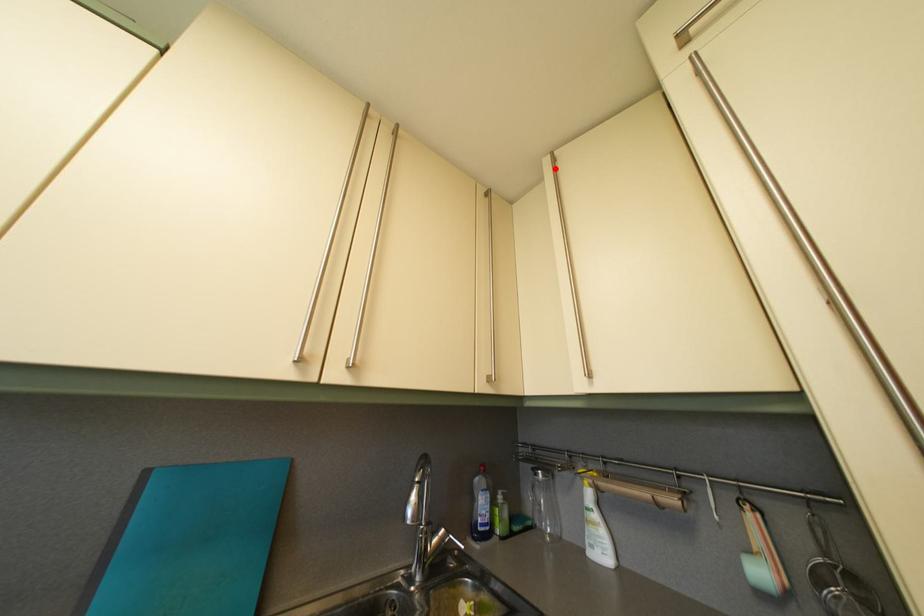
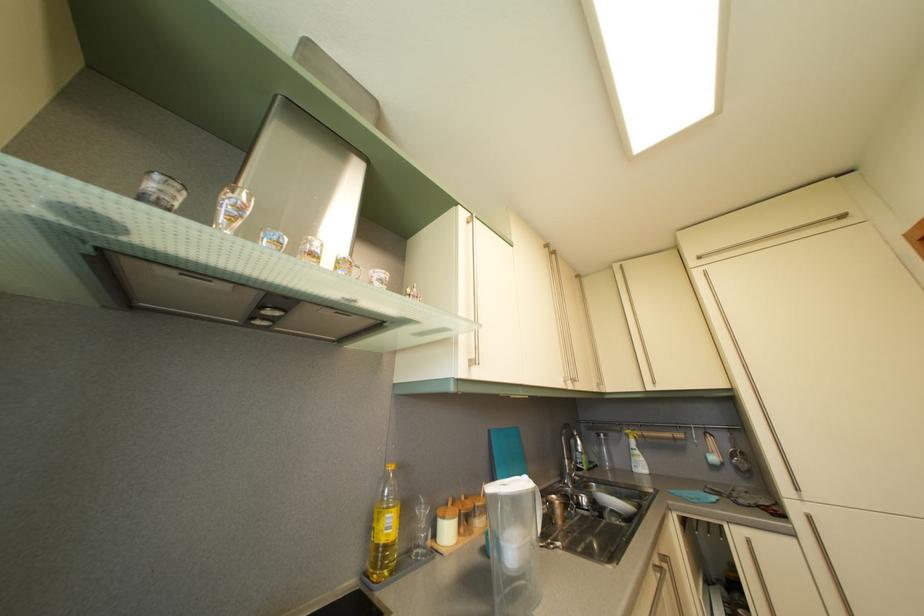
In the second image, find the point that corresponds to the highlighted location in the first image.

(624, 274)